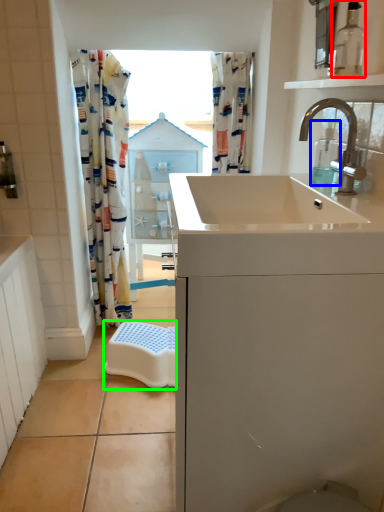
Question: Based on their relative distances, which object is farther from bottle (highlighted by a red box)? Choose from soap dispenser (highlighted by a blue box) and stool (highlighted by a green box).

Choices:
 (A) soap dispenser
 (B) stool

Answer: (B)